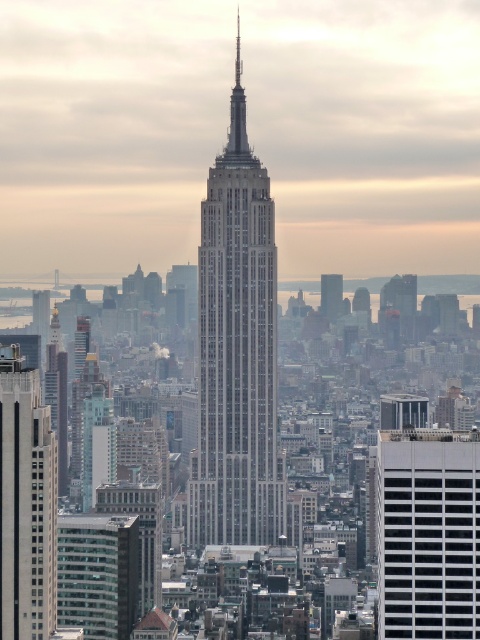
Is point (207, 452) positioned behind point (439, 598)?

No, (207, 452) is closer to viewer.

Can you confirm if white marble tower at center is positioned below white glass building at right?

Incorrect, white marble tower at center is not positioned below white glass building at right.

Find the location of a particular element. white marble tower at center is located at coordinates (237, 352).

Does white glass building at right have a larger size compared to glassy reflective skyscraper at center?

Indeed, white glass building at right has a larger size compared to glassy reflective skyscraper at center.

Is point (404, 564) closer to camera compared to point (61, 518)?

No, (404, 564) is behind (61, 518).

Which is behind, point (418, 515) or point (132, 598)?

The point (132, 598) is more distant.

At what (x,y) coordinates should I click in order to perform the action: click on white glass building at right. Please return your answer as a coordinate pair (x, y). The image size is (480, 640). Looking at the image, I should click on (428, 532).

Who is higher up, white marble tower at center or gray stone skyscraper at center?

white marble tower at center is higher up.

Is white marble tower at center taller than gray stone skyscraper at center?

Yes, white marble tower at center is taller than gray stone skyscraper at center.

Who is more forward, (269, 403) or (330, 316)?

Positioned in front is point (269, 403).

Identify the location of white marble tower at center. (237, 352).